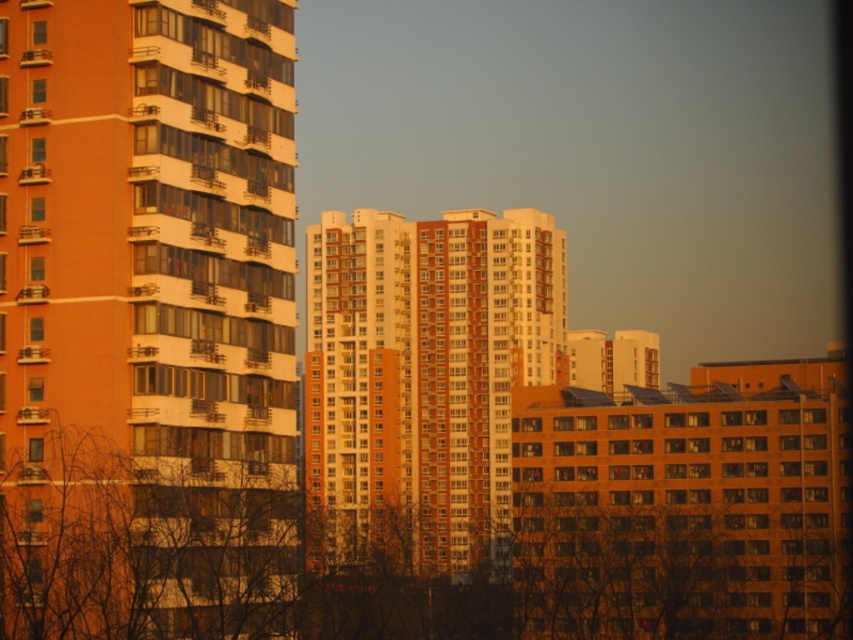
Question: Is brown leafless branches at lower left behind orange brick building at center?

Choices:
 (A) yes
 (B) no

Answer: (B)

Question: Which of the following is the farthest from the observer?

Choices:
 (A) brown leafless branches at lower left
 (B) orange brick building at center
 (C) matte orange building at left

Answer: (B)

Question: Which point is closer to the camera taking this photo?

Choices:
 (A) (418, 614)
 (B) (207, 61)

Answer: (B)

Question: Does matte orange building at left appear under brown leafless branches at lower left?

Choices:
 (A) no
 (B) yes

Answer: (A)

Question: Where is matte orange building at left located in relation to brown leafless branches at lower left in the image?

Choices:
 (A) above
 (B) below

Answer: (A)

Question: Which is nearer to the orange brick building at center?

Choices:
 (A) brown leafless branches at lower left
 (B) matte orange building at left

Answer: (A)